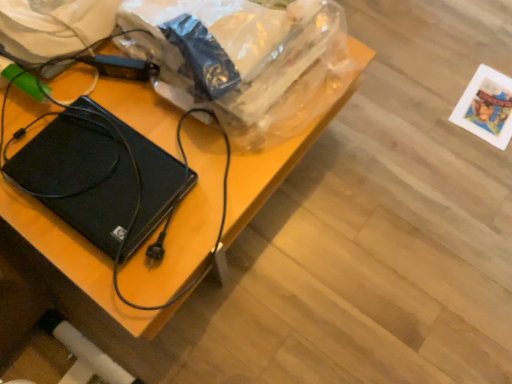
Question: From a real-world perspective, is plastic bag at upper center below black matte laptop at left?

Choices:
 (A) no
 (B) yes

Answer: (A)

Question: Does plastic bag at upper center appear on the left side of black matte laptop at left?

Choices:
 (A) yes
 (B) no

Answer: (B)

Question: Is plastic bag at upper center far from black matte laptop at left?

Choices:
 (A) no
 (B) yes

Answer: (A)

Question: Is plastic bag at upper center not inside black matte laptop at left?

Choices:
 (A) yes
 (B) no

Answer: (A)

Question: Would you say black matte laptop at left is part of plastic bag at upper center's contents?

Choices:
 (A) no
 (B) yes

Answer: (A)

Question: From a real-world perspective, is plastic bag at upper center located higher than black matte laptop at left?

Choices:
 (A) no
 (B) yes

Answer: (B)

Question: Considering the relative sizes of black plastic hard drive at center and plastic bag at upper center in the image provided, is black plastic hard drive at center thinner than plastic bag at upper center?

Choices:
 (A) yes
 (B) no

Answer: (B)

Question: From the image's perspective, is black plastic hard drive at center below plastic bag at upper center?

Choices:
 (A) yes
 (B) no

Answer: (A)

Question: From the image's perspective, is black plastic hard drive at center on top of plastic bag at upper center?

Choices:
 (A) no
 (B) yes

Answer: (A)

Question: Is black plastic hard drive at center outside plastic bag at upper center?

Choices:
 (A) yes
 (B) no

Answer: (A)

Question: Considering the relative positions of black plastic hard drive at center and plastic bag at upper center in the image provided, is black plastic hard drive at center to the left of plastic bag at upper center from the viewer's perspective?

Choices:
 (A) yes
 (B) no

Answer: (A)

Question: Considering the relative sizes of black plastic hard drive at center and plastic bag at upper center in the image provided, is black plastic hard drive at center smaller than plastic bag at upper center?

Choices:
 (A) yes
 (B) no

Answer: (B)

Question: Can you confirm if black plastic hard drive at center is positioned to the right of black matte laptop at left?

Choices:
 (A) no
 (B) yes

Answer: (B)